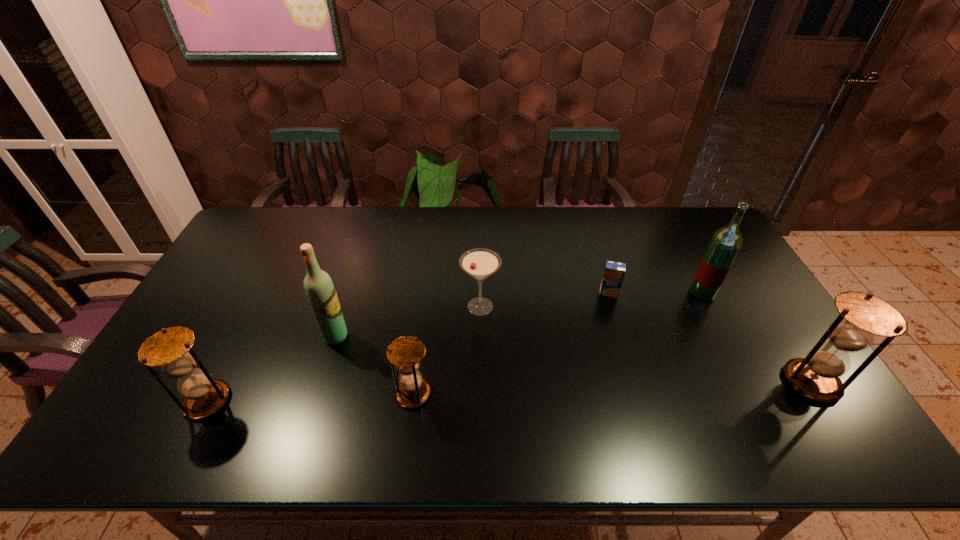
The height and width of the screenshot is (540, 960). What are the coordinates of `free location at the near right corner` in the screenshot? It's located at (795, 388).

What are the coordinates of `free space between the fourth shortest object and the fourth object from left to right` in the screenshot? It's located at point(344,354).

Find the location of a particular element. This screenshot has width=960, height=540. vacant area that lies between the second tallest hourglass and the liquor is located at coordinates (455, 347).

Locate an element on the screen. The height and width of the screenshot is (540, 960). free spot between the shortest object and the liquor is located at coordinates (656, 293).

Identify the location of free area in between the third tallest object and the fourth nearest object. The image size is (960, 540). (573, 359).

This screenshot has height=540, width=960. In order to click on vacant point located between the second shortest hourglass and the third object from left to right in this screenshot , I will do `click(310, 397)`.

Image resolution: width=960 pixels, height=540 pixels. I want to click on free area in between the fifth object from right to left and the tallest hourglass, so click(612, 388).

I want to click on free spot between the liquor and the second hourglass from left to right, so click(558, 343).

Find the location of a particular element. vacant area that lies between the leftmost hourglass and the third object from left to right is located at coordinates (310, 397).

Find the location of a particular element. The height and width of the screenshot is (540, 960). free space between the second object from right to left and the rightmost hourglass is located at coordinates (756, 338).